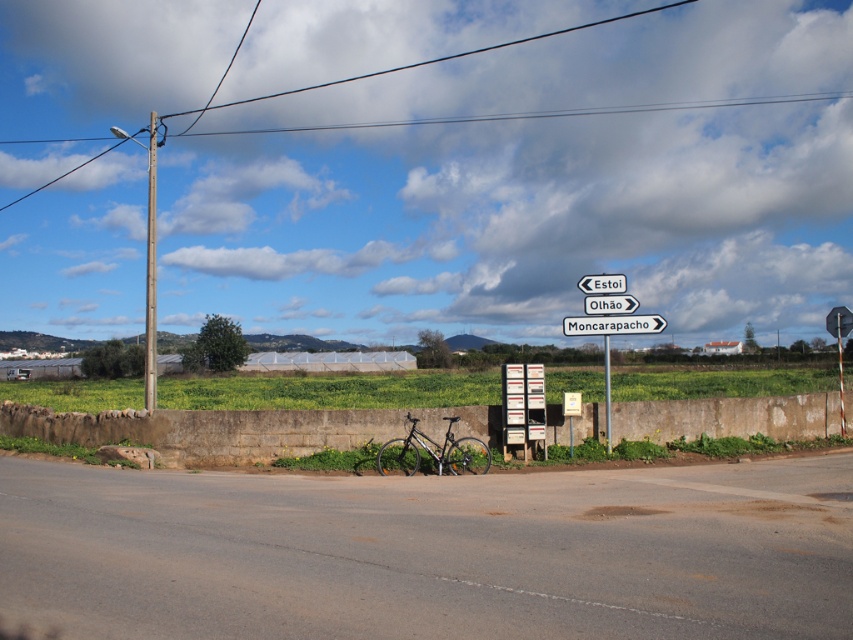
Question: Estimate the real-world distances between objects in this image. Which object is closer to the white plastic sign at upper center?

Choices:
 (A) white plastic signpost at center
 (B) white plastic sign at center right
 (C) metallic pole at center
 (D) metallic bicycle at center

Answer: (A)

Question: Which of the following is the farthest from the observer?

Choices:
 (A) white plastic signpost at center
 (B) metallic wire at upper center
 (C) metallic pole at left

Answer: (B)

Question: In this image, where is metallic wire at upper center located relative to silver metallic bicycle at center?

Choices:
 (A) right
 (B) left

Answer: (B)

Question: Which point is farther from the camera taking this photo?

Choices:
 (A) (473, 444)
 (B) (277, 378)

Answer: (B)

Question: Is silver metallic bicycle at center above metallic pole at center?

Choices:
 (A) no
 (B) yes

Answer: (A)

Question: Is metallic wire at upper center in front of metallic pole at center?

Choices:
 (A) yes
 (B) no

Answer: (B)